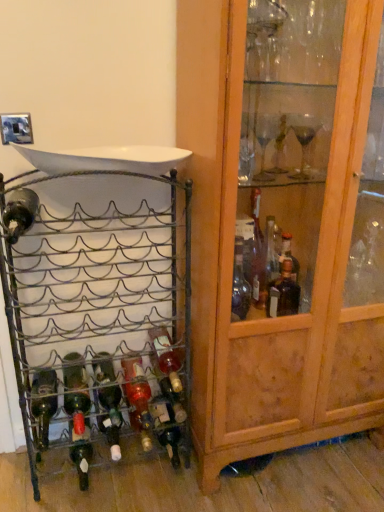
The width and height of the screenshot is (384, 512). Find the location of `green glass bottle at lower left, which is the second bottle from left to right`. green glass bottle at lower left, which is the second bottle from left to right is located at coordinates (75, 385).

Measure the distance between point (x=165, y=367) and camera.

Point (x=165, y=367) and camera are 1.49 meters apart.

In the scene shown: Measure the distance between translucent glass bottle at lower left, positioned as the third bottle in left-to-right order, and camera.

translucent glass bottle at lower left, positioned as the third bottle in left-to-right order, is 1.42 meters away from camera.

What do you see at coordinates (283, 221) in the screenshot? I see `wooden cabinet at right` at bounding box center [283, 221].

What do you see at coordinates (136, 391) in the screenshot? The image size is (384, 512). I see `translucent glass bottle at center, the fifth bottle when ordered from left to right` at bounding box center [136, 391].

How much space does green glass bottle at center, arranged as the third bottle when viewed from the right, occupy horizontally?

The width of green glass bottle at center, arranged as the third bottle when viewed from the right, is 10.98 inches.

This screenshot has height=512, width=384. What do you see at coordinates (106, 382) in the screenshot?
I see `green glass bottle at center, arranged as the third bottle when viewed from the right` at bounding box center [106, 382].

What do you see at coordinates (43, 404) in the screenshot? I see `green glass bottle at lower left, acting as the 6th bottle starting from the right` at bounding box center [43, 404].

What is the approximate height of green glass bottle at lower left, the first bottle in the left-to-right sequence?

The height of green glass bottle at lower left, the first bottle in the left-to-right sequence, is 2.72 inches.

What are the coordinates of `metallic wire wine rack at left` in the screenshot? It's located at (98, 306).

Where is `green glass bottle at lower left, which is the second bottle from left to right`? Image resolution: width=384 pixels, height=512 pixels. green glass bottle at lower left, which is the second bottle from left to right is located at coordinates (75, 385).

Is point (59, 334) positioned behind point (130, 404)?

Yes, point (59, 334) is behind point (130, 404).

From the image's perspective, which one is positioned higher, metallic wire wine rack at left or translucent glass bottle at center, the second bottle in the right-to-left sequence?

metallic wire wine rack at left, from the image's perspective.

Considering the relative positions of metallic wire wine rack at left and translucent glass bottle at center, the second bottle in the right-to-left sequence, in the image provided, is metallic wire wine rack at left behind translucent glass bottle at center, the second bottle in the right-to-left sequence,?

No, metallic wire wine rack at left is in front of translucent glass bottle at center, the second bottle in the right-to-left sequence.

Considering the relative sizes of green glass bottle at lower left, the first bottle in the left-to-right sequence, and green glass bottle at center, marked as the fourth bottle in a left-to-right arrangement, in the image provided, is green glass bottle at lower left, the first bottle in the left-to-right sequence, wider than green glass bottle at center, marked as the fourth bottle in a left-to-right arrangement,?

Indeed, green glass bottle at lower left, the first bottle in the left-to-right sequence, has a greater width compared to green glass bottle at center, marked as the fourth bottle in a left-to-right arrangement.

Considering the relative sizes of green glass bottle at lower left, the first bottle in the left-to-right sequence, and green glass bottle at center, marked as the fourth bottle in a left-to-right arrangement, in the image provided, is green glass bottle at lower left, the first bottle in the left-to-right sequence, shorter than green glass bottle at center, marked as the fourth bottle in a left-to-right arrangement,?

No.

Looking at this image, is green glass bottle at lower left, the first bottle in the left-to-right sequence, not near green glass bottle at center, marked as the fourth bottle in a left-to-right arrangement?

That's not correct — green glass bottle at lower left, the first bottle in the left-to-right sequence, is a little close to green glass bottle at center, marked as the fourth bottle in a left-to-right arrangement.

Can you tell me how much metallic wire wine rack at left and translucent glass bottle at center, arranged as the 6th bottle when viewed from the left, differ in facing direction?

There is a 0.344-degree angle between the facing directions of metallic wire wine rack at left and translucent glass bottle at center, arranged as the 6th bottle when viewed from the left.

From their relative heights in the image, would you say metallic wire wine rack at left is taller or shorter than translucent glass bottle at center, arranged as the 6th bottle when viewed from the left?

Clearly, metallic wire wine rack at left is taller compared to translucent glass bottle at center, arranged as the 6th bottle when viewed from the left.

Is metallic wire wine rack at left positioned far away from translucent glass bottle at center, placed as the first bottle when sorted from right to left?

No, metallic wire wine rack at left is not far away from translucent glass bottle at center, placed as the first bottle when sorted from right to left.

Could you measure the distance between metallic wire wine rack at left and translucent glass bottle at center, arranged as the 6th bottle when viewed from the left?

metallic wire wine rack at left and translucent glass bottle at center, arranged as the 6th bottle when viewed from the left, are 11.33 inches apart from each other.

From their relative heights in the image, would you say wooden cabinet at right is taller or shorter than translucent glass bottle at lower left, arranged as the 4th bottle when viewed from the right?

Considering their sizes, wooden cabinet at right has more height than translucent glass bottle at lower left, arranged as the 4th bottle when viewed from the right.

Is point (377, 25) positioned after point (87, 426)?

No, (377, 25) is in front of (87, 426).

Measure the distance between green glass bottle at center, marked as the fourth bottle in a left-to-right arrangement, and green glass bottle at lower left, acting as the 6th bottle starting from the right.

They are 21.02 centimeters apart.

From the picture: Is green glass bottle at center, arranged as the third bottle when viewed from the right, facing towards green glass bottle at lower left, acting as the 6th bottle starting from the right?

No, green glass bottle at center, arranged as the third bottle when viewed from the right, is not aimed at green glass bottle at lower left, acting as the 6th bottle starting from the right.

Are green glass bottle at center, marked as the fourth bottle in a left-to-right arrangement, and green glass bottle at lower left, acting as the 6th bottle starting from the right, beside each other?

green glass bottle at center, marked as the fourth bottle in a left-to-right arrangement, and green glass bottle at lower left, acting as the 6th bottle starting from the right, are not in contact.

Which object is positioned more to the right, green glass bottle at center, arranged as the third bottle when viewed from the right, or green glass bottle at lower left, acting as the 6th bottle starting from the right?

Positioned to the right is green glass bottle at center, arranged as the third bottle when viewed from the right.

What's the angular difference between green glass bottle at lower left, which is the second bottle from left to right, and green glass bottle at center, arranged as the third bottle when viewed from the right,'s facing directions?

There is a 0.503-degree angle between the facing directions of green glass bottle at lower left, which is the second bottle from left to right, and green glass bottle at center, arranged as the third bottle when viewed from the right.

Is green glass bottle at lower left, which is the second bottle from left to right, in front of or behind green glass bottle at center, marked as the fourth bottle in a left-to-right arrangement, in the image?

Visually, green glass bottle at lower left, which is the second bottle from left to right, is located in front of green glass bottle at center, marked as the fourth bottle in a left-to-right arrangement.

Based on their positions, is green glass bottle at lower left, the 5th bottle when ordered from right to left, located to the left or right of green glass bottle at center, arranged as the third bottle when viewed from the right?

In the image, green glass bottle at lower left, the 5th bottle when ordered from right to left, appears on the left side of green glass bottle at center, arranged as the third bottle when viewed from the right.

Is green glass bottle at center, arranged as the third bottle when viewed from the right, thinner than translucent glass bottle at center, the fifth bottle when ordered from left to right?

Correct, the width of green glass bottle at center, arranged as the third bottle when viewed from the right, is less than that of translucent glass bottle at center, the fifth bottle when ordered from left to right.

Are green glass bottle at center, marked as the fourth bottle in a left-to-right arrangement, and translucent glass bottle at center, the second bottle in the right-to-left sequence, located far from each other?

green glass bottle at center, marked as the fourth bottle in a left-to-right arrangement, is near translucent glass bottle at center, the second bottle in the right-to-left sequence, not far away.

From a real-world perspective, between green glass bottle at center, arranged as the third bottle when viewed from the right, and translucent glass bottle at center, the second bottle in the right-to-left sequence, who is vertically higher?

green glass bottle at center, arranged as the third bottle when viewed from the right, is physically above.

Is green glass bottle at center, arranged as the third bottle when viewed from the right, behind translucent glass bottle at center, the fifth bottle when ordered from left to right?

No, green glass bottle at center, arranged as the third bottle when viewed from the right, is closer to the camera.

Image resolution: width=384 pixels, height=512 pixels. I want to click on the 4th bottle behind when counting from the metallic wire wine rack at left, so click(x=136, y=391).

Where is `bottle that is the 3rd object to the left of the green glass bottle at center, marked as the fourth bottle in a left-to-right arrangement, starting at the anchor`? bottle that is the 3rd object to the left of the green glass bottle at center, marked as the fourth bottle in a left-to-right arrangement, starting at the anchor is located at coordinates (43, 404).

Looking at the image, which one is located further to translucent glass bottle at center, placed as the first bottle when sorted from right to left, green glass bottle at lower left, acting as the 6th bottle starting from the right, or translucent glass bottle at center, the second bottle in the right-to-left sequence?

Among the two, green glass bottle at lower left, acting as the 6th bottle starting from the right, is located further to translucent glass bottle at center, placed as the first bottle when sorted from right to left.

In the scene shown: When comparing their distances from metallic wire wine rack at left, does translucent glass bottle at center, arranged as the 6th bottle when viewed from the left, or translucent glass bottle at lower left, arranged as the 4th bottle when viewed from the right, seem further?

Among the two, translucent glass bottle at lower left, arranged as the 4th bottle when viewed from the right, is located further to metallic wire wine rack at left.

Looking at the image, which one is located closer to translucent glass bottle at center, the fifth bottle when ordered from left to right, wooden cabinet at right or green glass bottle at center, arranged as the third bottle when viewed from the right?

green glass bottle at center, arranged as the third bottle when viewed from the right, is positioned closer to the anchor translucent glass bottle at center, the fifth bottle when ordered from left to right.

Which object lies further to the anchor point metallic wire wine rack at left, green glass bottle at lower left, the 5th bottle when ordered from right to left, or translucent glass bottle at lower left, arranged as the 4th bottle when viewed from the right?

translucent glass bottle at lower left, arranged as the 4th bottle when viewed from the right, is positioned further to the anchor metallic wire wine rack at left.

Looking at the image, which one is located closer to wooden cabinet at right, translucent glass bottle at lower left, arranged as the 4th bottle when viewed from the right, or green glass bottle at center, arranged as the third bottle when viewed from the right?

Among the two, green glass bottle at center, arranged as the third bottle when viewed from the right, is located nearer to wooden cabinet at right.

Estimate the real-world distances between objects in this image. Which object is closer to translucent glass bottle at center, the fifth bottle when ordered from left to right, green glass bottle at center, marked as the fourth bottle in a left-to-right arrangement, or green glass bottle at lower left, acting as the 6th bottle starting from the right?

green glass bottle at center, marked as the fourth bottle in a left-to-right arrangement, is positioned closer to the anchor translucent glass bottle at center, the fifth bottle when ordered from left to right.

Which object lies nearer to the anchor point green glass bottle at lower left, which is the second bottle from left to right, green glass bottle at lower left, acting as the 6th bottle starting from the right, or wooden cabinet at right?

Based on the image, green glass bottle at lower left, acting as the 6th bottle starting from the right, appears to be nearer to green glass bottle at lower left, which is the second bottle from left to right.

From the image, which object appears to be farther from translucent glass bottle at center, arranged as the 6th bottle when viewed from the left, green glass bottle at lower left, which is the second bottle from left to right, or wooden cabinet at right?

Among the two, wooden cabinet at right is located further to translucent glass bottle at center, arranged as the 6th bottle when viewed from the left.

You are a GUI agent. You are given a task and a screenshot of the screen. Output one action in this format:
    pyautogui.click(x=<x>, y=<y>)
    Task: Click on the shelf between green glass bottle at lower left, which is the second bottle from left to right, and wooden cabinet at right from left to right
    The image size is (384, 512).
    Given the screenshot: What is the action you would take?
    pyautogui.click(x=98, y=306)

Where is `bottle between translucent glass bottle at center, the second bottle in the right-to-left sequence, and wooden cabinet at right, in the horizontal direction`? bottle between translucent glass bottle at center, the second bottle in the right-to-left sequence, and wooden cabinet at right, in the horizontal direction is located at coordinates (165, 357).

Find the location of a particular element. bottle between green glass bottle at center, arranged as the third bottle when viewed from the right, and translucent glass bottle at lower left, positioned as the third bottle in left-to-right order, from top to bottom is located at coordinates (43, 404).

The height and width of the screenshot is (512, 384). Find the location of `shelf between green glass bottle at lower left, the first bottle in the left-to-right sequence, and translucent glass bottle at center, the fifth bottle when ordered from left to right`. shelf between green glass bottle at lower left, the first bottle in the left-to-right sequence, and translucent glass bottle at center, the fifth bottle when ordered from left to right is located at coordinates (98, 306).